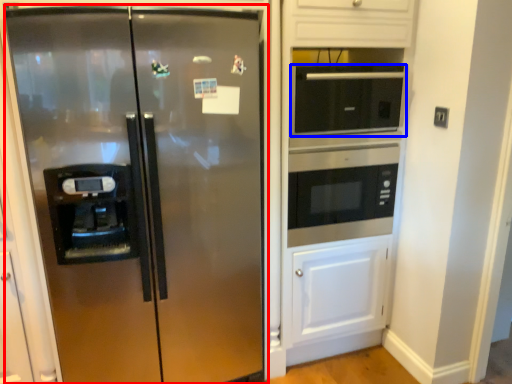
Question: Which object appears farthest to the camera in this image, refrigerator (highlighted by a red box) or microwave oven (highlighted by a blue box)?

Choices:
 (A) refrigerator
 (B) microwave oven

Answer: (B)